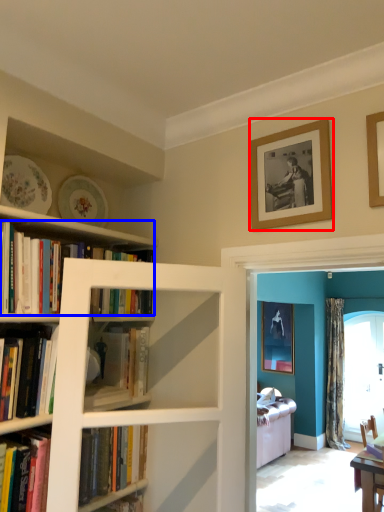
Question: Which object is further to the camera taking this photo, picture frame (highlighted by a red box) or book (highlighted by a blue box)?

Choices:
 (A) picture frame
 (B) book

Answer: (A)